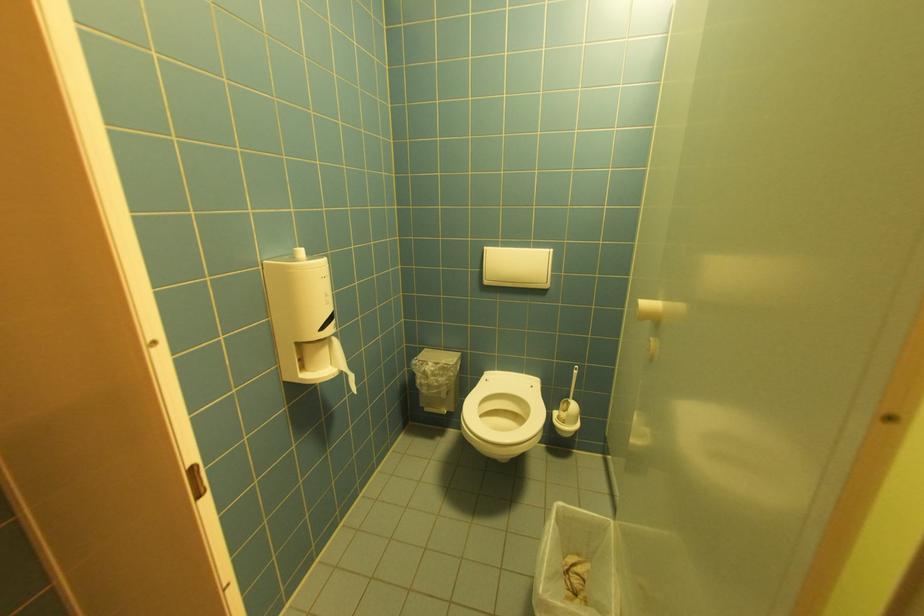
Where would you lift the toilet brush handle? Please return your answer as a coordinate pair (x, y).

(573, 381)